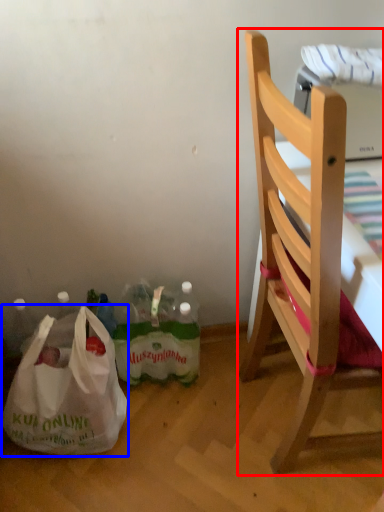
Question: Among these objects, which one is farthest to the camera, chair (highlighted by a red box) or plastic bag (highlighted by a blue box)?

Choices:
 (A) chair
 (B) plastic bag

Answer: (B)